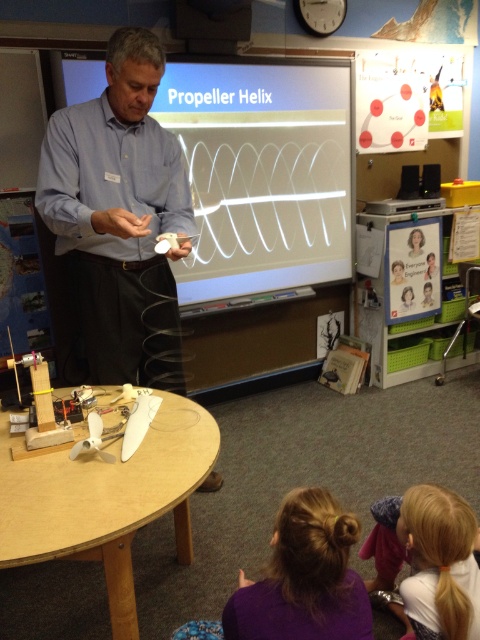
Question: Does matte white propeller helix at center appear on the left side of blonde hair bun at lower center?

Choices:
 (A) no
 (B) yes

Answer: (B)

Question: Which of the following is the closest to the observer?

Choices:
 (A) (48, 225)
 (B) (261, 253)

Answer: (A)

Question: Estimate the real-world distances between objects in this image. Which object is closer to the matte white propeller helix at center?

Choices:
 (A) matte blue shirt at center
 (B) blonde hair at lower right

Answer: (A)

Question: Which object is positioned closest to the blonde hair at lower right?

Choices:
 (A) blonde hair bun at lower center
 (B) matte white propeller helix at center

Answer: (A)

Question: Can you confirm if matte blue shirt at center is positioned above blonde hair at lower right?

Choices:
 (A) yes
 (B) no

Answer: (A)

Question: Can you confirm if blonde hair bun at lower center is wider than blonde hair at lower right?

Choices:
 (A) yes
 (B) no

Answer: (A)